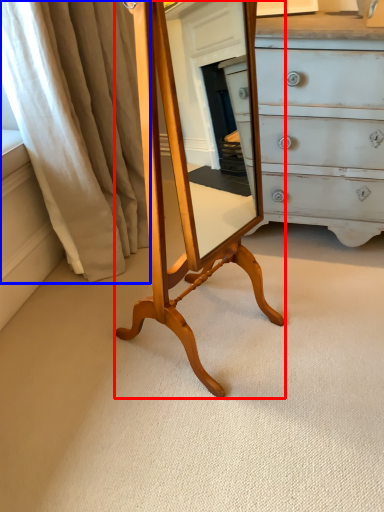
Question: Which of the following is the farthest to the observer, table (highlighted by a red box) or curtain (highlighted by a blue box)?

Choices:
 (A) table
 (B) curtain

Answer: (B)